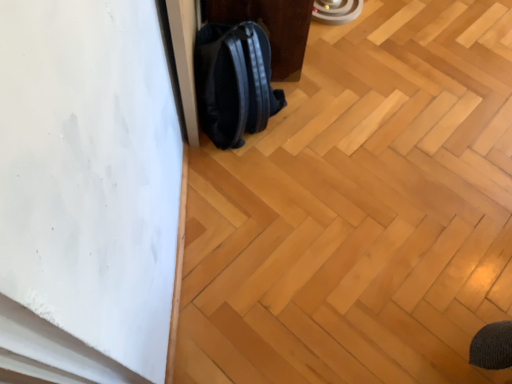
Measure the distance between natural wood floor at center and camera.

natural wood floor at center and camera are 3.84 feet apart.

Locate an element on the screen. This screenshot has height=384, width=512. natural wood floor at center is located at coordinates (360, 210).

From a real-world perspective, is black leather backpack at lower left above or below natural wood floor at center?

From a real-world perspective, black leather backpack at lower left is physically above natural wood floor at center.

Identify the location of plywood lying below the black leather backpack at lower left (from the image's perspective). (360, 210).

Could you tell me if black leather backpack at lower left is facing natural wood floor at center?

No.

Is point (223, 1) positioned before point (325, 30)?

Yes, it is.

Is black matte backpack at center spatially inside natural wood floor at center, or outside of it?

The correct answer is: outside.

This screenshot has height=384, width=512. I want to click on plywood on the right of black matte backpack at center, so click(x=360, y=210).

Who is more distant, black matte backpack at center or natural wood floor at center?

Positioned behind is black matte backpack at center.

Could you tell me if black matte backpack at center is turned towards natural wood floor at center?

Yes, black matte backpack at center faces towards natural wood floor at center.

Which object is closer to the camera taking this photo, natural wood floor at center or black leather backpack at lower left?

natural wood floor at center is in front.

Does natural wood floor at center touch black leather backpack at lower left?

No, natural wood floor at center is not making contact with black leather backpack at lower left.

Can you confirm if natural wood floor at center is positioned to the left of black leather backpack at lower left?

No.

Is black leather backpack at lower left facing towards black matte backpack at center?

No, black leather backpack at lower left is not facing towards black matte backpack at center.

Is point (288, 45) more distant than point (232, 125)?

That is True.

Locate an element on the screen. This screenshot has width=512, height=384. backpack that appears below the black leather backpack at lower left (from the image's perspective) is located at coordinates (234, 82).

Is black matte backpack at center a part of black leather backpack at lower left?

No, black matte backpack at center is located outside of black leather backpack at lower left.

From the picture: Is natural wood floor at center spatially inside black matte backpack at center, or outside of it?

natural wood floor at center is located beyond the bounds of black matte backpack at center.

Is natural wood floor at center not near black matte backpack at center?

That's not correct — natural wood floor at center is a little close to black matte backpack at center.

From a real-world perspective, is natural wood floor at center below black matte backpack at center?

Yes, from a real-world perspective, natural wood floor at center is beneath black matte backpack at center.

Is natural wood floor at center smaller than black matte backpack at center?

Actually, natural wood floor at center might be larger than black matte backpack at center.

From a real-world perspective, who is located higher, black matte backpack at center or black leather backpack at lower left?

black matte backpack at center is physically above.

How many degrees apart are the facing directions of black matte backpack at center and black leather backpack at lower left?

The angular difference between black matte backpack at center and black leather backpack at lower left is 0.000352 degrees.

Visually, is black matte backpack at center positioned to the left or to the right of black leather backpack at lower left?

From the image, it's evident that black matte backpack at center is to the left of black leather backpack at lower left.

Is the surface of black matte backpack at center in direct contact with black leather backpack at lower left?

No, black matte backpack at center is not in contact with black leather backpack at lower left.

Find the location of a particular element. The image size is (512, 384). furniture that appears on the left of natural wood floor at center is located at coordinates (270, 28).

The width and height of the screenshot is (512, 384). I want to click on backpack above the natural wood floor at center (from a real-world perspective), so click(x=234, y=82).

Which object lies nearer to the anchor point black matte backpack at center, natural wood floor at center or black leather backpack at lower left?

black leather backpack at lower left.

Considering their positions, is black leather backpack at lower left positioned further to black matte backpack at center than natural wood floor at center?

Among the two, natural wood floor at center is located further to black matte backpack at center.

Which object lies nearer to the anchor point natural wood floor at center, black matte backpack at center or black leather backpack at lower left?

black matte backpack at center is closer to natural wood floor at center.

When comparing their distances from black leather backpack at lower left, does natural wood floor at center or black matte backpack at center seem closer?

black matte backpack at center.

Based on their spatial positions, is black matte backpack at center or natural wood floor at center closer to black leather backpack at lower left?

black matte backpack at center is positioned closer to the anchor black leather backpack at lower left.

Based on their spatial positions, is black leather backpack at lower left or black matte backpack at center further from natural wood floor at center?

black leather backpack at lower left is further to natural wood floor at center.

At what (x,y) coordinates should I click in order to perform the action: click on furniture located between black matte backpack at center and natural wood floor at center in the left-right direction. Please return your answer as a coordinate pair (x, y). Looking at the image, I should click on (270, 28).